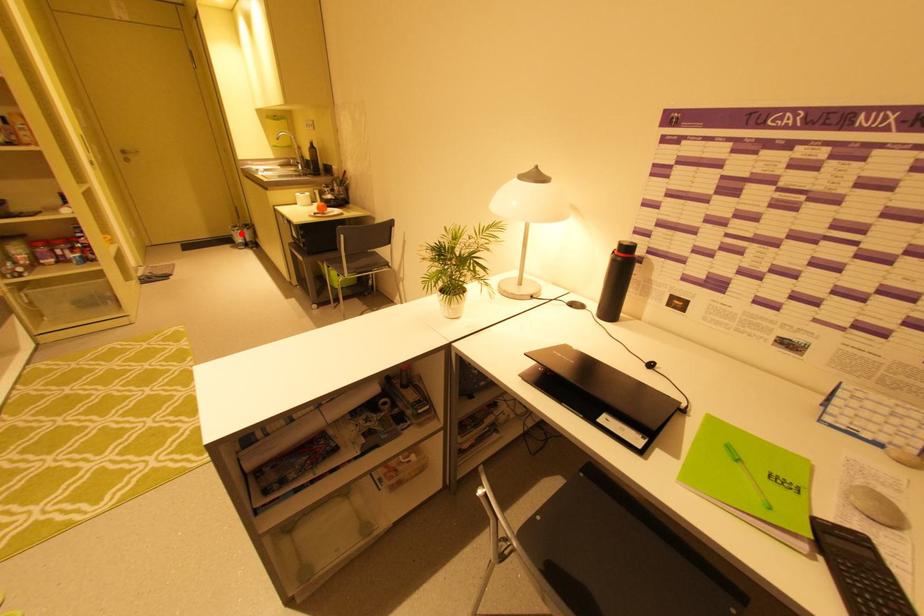
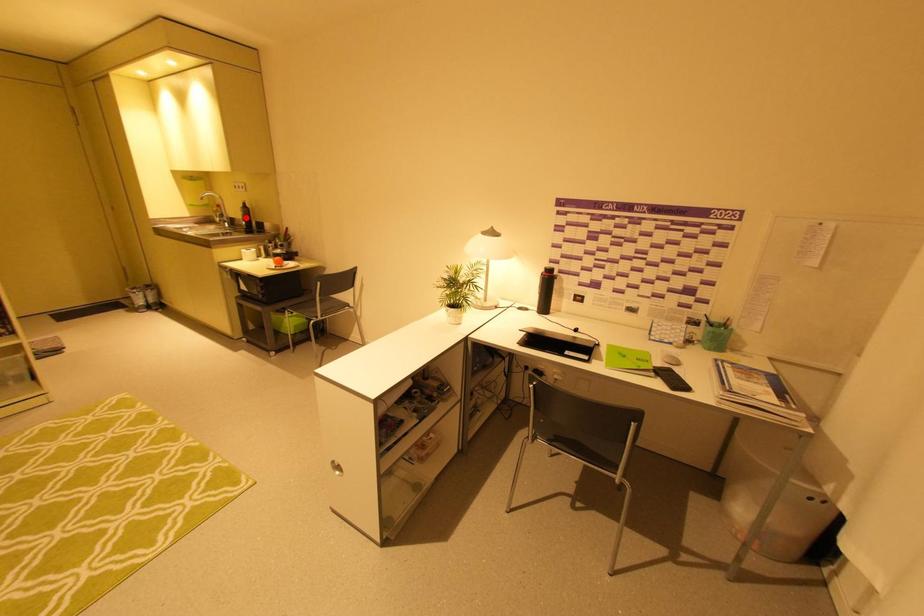
I am providing you with two images of the same scene from different viewpoints. A red point is marked on the first image and another point is marked on the second image. Is the red point in image1 aligned with the point shown in image2?

No